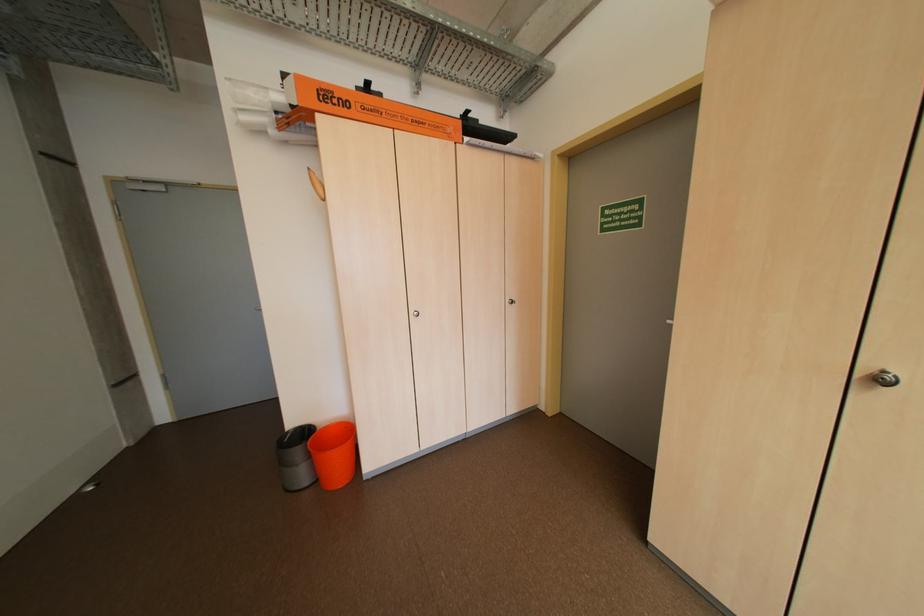
You are a GUI agent. You are given a task and a screenshot of the screen. Output one action in this format:
    pyautogui.click(x=<x>, y=<y>)
    Task: Click on the orange trash can
    This screenshot has height=616, width=924.
    Given the screenshot: What is the action you would take?
    pyautogui.click(x=334, y=454)